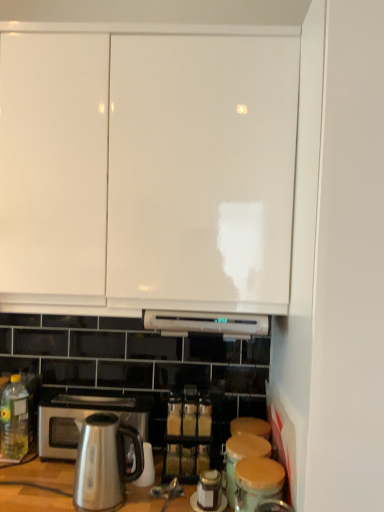
Locate an element on the screen. empty space that is ontop of satin silver microwave oven at lower left (from a real-world perspective) is located at coordinates (90, 397).